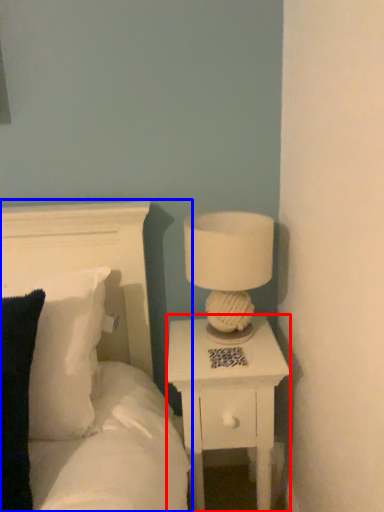
Question: Among these objects, which one is farthest to the camera, nightstand (highlighted by a red box) or bed (highlighted by a blue box)?

Choices:
 (A) nightstand
 (B) bed

Answer: (A)